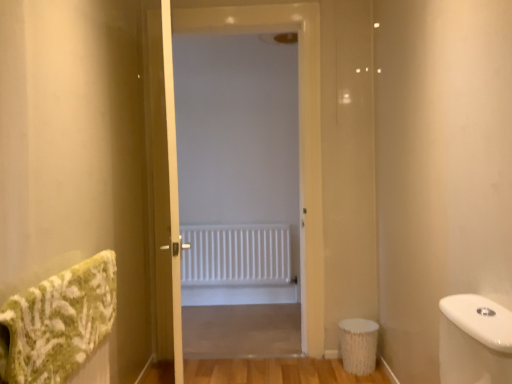
Describe the element at coordinates (163, 185) in the screenshot. I see `wooden screen door at center` at that location.

The width and height of the screenshot is (512, 384). Describe the element at coordinates (358, 345) in the screenshot. I see `white textured toilet bowl at lower right` at that location.

In order to face white matte radiator at center, should I rotate leftwards or rightwards?

It's best to rotate left around 2.227 degrees.

What are the coordinates of `wooden screen door at center` in the screenshot? It's located at (163, 185).

From the image's perspective, relative to white matte radiator at center, is wooden screen door at center above or below?

Based on their image positions, wooden screen door at center is located above white matte radiator at center.

Considering the relative sizes of wooden screen door at center and white matte radiator at center in the image provided, is wooden screen door at center smaller than white matte radiator at center?

No, wooden screen door at center is not smaller than white matte radiator at center.

Considering the sizes of objects wooden screen door at center and white matte radiator at center in the image provided, who is wider, wooden screen door at center or white matte radiator at center?

wooden screen door at center.

How many degrees apart are the facing directions of wooden screen door at center and white matte radiator at center?

They differ by 103 degrees in their facing directions.

Is white matte radiator at center aimed at green textured bath towel at left?

Yes.

How distant is white matte radiator at center from green textured bath towel at left?

white matte radiator at center and green textured bath towel at left are 33.23 inches apart from each other.

Considering the relative sizes of white matte radiator at center and green textured bath towel at left in the image provided, is white matte radiator at center shorter than green textured bath towel at left?

In fact, white matte radiator at center may be taller than green textured bath towel at left.

Would you say white matte radiator at center is inside or outside green textured bath towel at left?

The correct answer is: outside.

Considering the sizes of objects white matte radiator at center and green textured bath towel at left in the image provided, who is bigger, white matte radiator at center or green textured bath towel at left?

green textured bath towel at left is bigger.

Does point (222, 238) lie in front of point (24, 304)?

No.

From a real-world perspective, which object rests below the other?

In real-world perspective, white matte radiator at center is lower.

Considering the relative sizes of white matte radiator at center and green textured bath towel at left in the image provided, is white matte radiator at center thinner than green textured bath towel at left?

Correct, the width of white matte radiator at center is less than that of green textured bath towel at left.

Does point (75, 372) appear closer or farther from the camera than point (355, 371)?

Point (75, 372) appears to be closer to the viewer than point (355, 371).

From a real-world perspective, is green textured bath towel at left physically below white textured toilet bowl at lower right?

No, from a real-world perspective, green textured bath towel at left is not below white textured toilet bowl at lower right.

Considering the sizes of objects green textured bath towel at left and white textured toilet bowl at lower right in the image provided, who is thinner, green textured bath towel at left or white textured toilet bowl at lower right?

With smaller width is green textured bath towel at left.

Is green textured bath towel at left positioned beyond the bounds of white textured toilet bowl at lower right?

green textured bath towel at left is positioned outside white textured toilet bowl at lower right.

From a real-world perspective, is wooden screen door at center physically below white textured toilet bowl at lower right?

No, from a real-world perspective, wooden screen door at center is not below white textured toilet bowl at lower right.

Does point (170, 176) appear closer or farther from the camera than point (364, 332)?

Point (170, 176) appears to be farther away from the viewer than point (364, 332).

Which object is thinner, wooden screen door at center or white textured toilet bowl at lower right?

wooden screen door at center.

From the picture: Between wooden screen door at center and white textured toilet bowl at lower right, which one is positioned behind?

white textured toilet bowl at lower right is behind.

Is white matte radiator at center at the back of green textured bath towel at left?

green textured bath towel at left does not have its back to white matte radiator at center.

From the image's perspective, which one is positioned higher, green textured bath towel at left or white matte radiator at center?

white matte radiator at center.

Does point (76, 356) appear closer or farther from the camera than point (226, 22)?

Point (76, 356).

From a real-world perspective, is white matte radiator at center beneath wooden screen door at center?

Yes, from a real-world perspective, white matte radiator at center is below wooden screen door at center.

Considering the sizes of objects white matte radiator at center and wooden screen door at center in the image provided, who is thinner, white matte radiator at center or wooden screen door at center?

→ Thinner between the two is white matte radiator at center.

Is the surface of white matte radiator at center in direct contact with wooden screen door at center?

No.

Which object is further away from the camera, white matte radiator at center or wooden screen door at center?

white matte radiator at center is behind.

Identify the location of radiator on the right of the wooden screen door at center. Image resolution: width=512 pixels, height=384 pixels. (236, 255).

This screenshot has height=384, width=512. I want to click on door behind the green textured bath towel at left, so click(x=176, y=156).

Which object lies nearer to the anchor point white textured toilet bowl at lower right, green textured bath towel at left or white matte radiator at center?

white matte radiator at center.

Estimate the real-world distances between objects in this image. Which object is further from wooden screen door at center, white matte radiator at center or white matte radiator at center?

Based on the image, white matte radiator at center appears to be further to wooden screen door at center.

When comparing their distances from white textured toilet bowl at lower right, does white matte radiator at center or wooden screen door at center seem further?

Among the two, wooden screen door at center is located further to white textured toilet bowl at lower right.

When comparing their distances from green textured bath towel at left, does wooden screen door at center or white matte radiator at center seem further?

white matte radiator at center lies further to green textured bath towel at left than the other object.

Considering their positions, is white textured toilet bowl at lower right positioned closer to white matte radiator at center than green textured bath towel at left?

white textured toilet bowl at lower right lies closer to white matte radiator at center than the other object.

Estimate the real-world distances between objects in this image. Which object is closer to white textured toilet bowl at lower right, white matte radiator at center or green textured bath towel at left?

The object closer to white textured toilet bowl at lower right is white matte radiator at center.

From the image, which object appears to be farther from wooden screen door at center, white matte radiator at center or green textured bath towel at left?

white matte radiator at center.

Looking at the image, which one is located closer to white matte radiator at center, white matte radiator at center or white textured toilet bowl at lower right?

white matte radiator at center.

The image size is (512, 384). In order to click on screen door positioned between green textured bath towel at left and white matte radiator at center from near to far in this screenshot , I will do `click(163, 185)`.

Find the location of a particular element. This screenshot has height=384, width=512. toilet bowl between green textured bath towel at left and white matte radiator at center from front to back is located at coordinates (358, 345).

Locate an element on the screen. door between green textured bath towel at left and white matte radiator at center from front to back is located at coordinates (176, 156).

The image size is (512, 384). I want to click on door between wooden screen door at center and white matte radiator at center in the front-back direction, so click(176, 156).